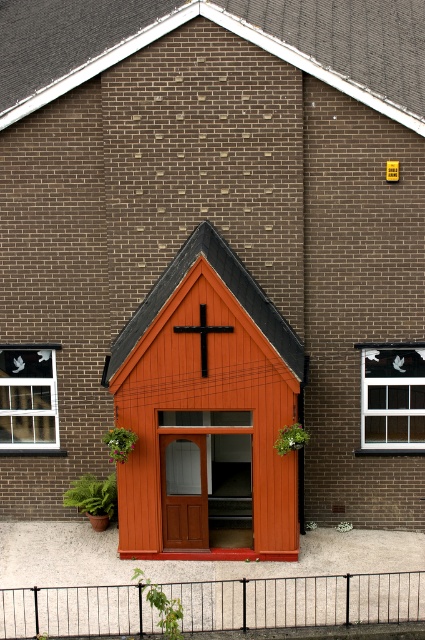
You are an architect examining the brick building. You have two points marked on your blueprint at coordinates point [127,412] and point [31,401]. Which point is closer to the camera in the image?

Point [127,412] is closer to the camera than point [31,401].

You are an architect reviewing the building design. You notice the clear glass window at left and the black matte cross at center. Which object is positioned higher in the image?

The black matte cross at center is positioned higher than the clear glass window at left.